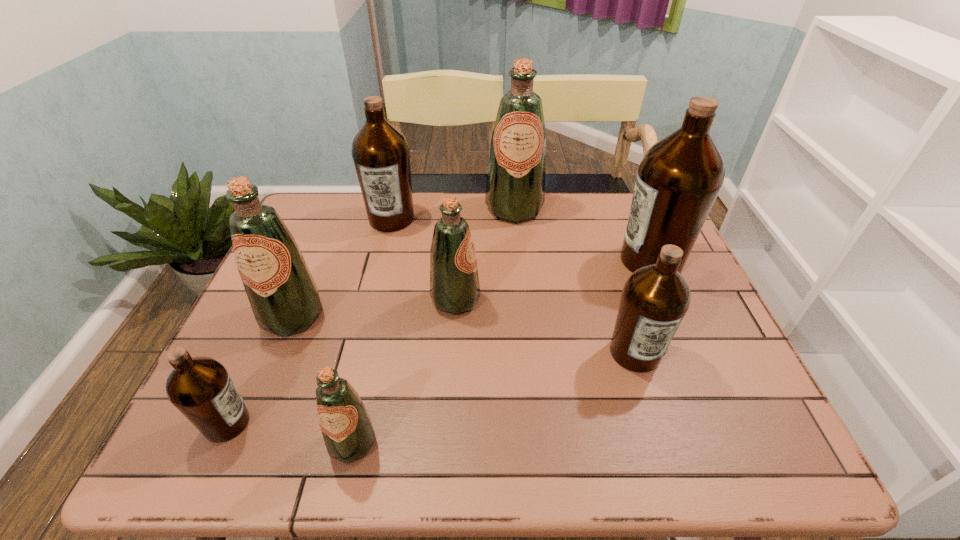
Select which olive oil appears as the seventh closest to the second nearest brown olive oil. Please provide its 2D coordinates. Your answer should be formatted as a tuple, i.e. [(x, y)], where the tuple contains the x and y coordinates of a point satisfying the conditions above.

[(200, 388)]

Choose which olive oil is the nearest neighbor to the leftmost green olive oil. Please provide its 2D coordinates. Your answer should be formatted as a tuple, i.e. [(x, y)], where the tuple contains the x and y coordinates of a point satisfying the conditions above.

[(200, 388)]

Identify which green olive oil is located as the second nearest to the third object from right to left. Please provide its 2D coordinates. Your answer should be formatted as a tuple, i.e. [(x, y)], where the tuple contains the x and y coordinates of a point satisfying the conditions above.

[(284, 298)]

The width and height of the screenshot is (960, 540). Find the location of `green olive oil object that ranks as the second closest to the third nearest brown olive oil`. green olive oil object that ranks as the second closest to the third nearest brown olive oil is located at coordinates (454, 282).

Choose which brown olive oil is the nearest neighbor to the third biggest brown olive oil. Please provide its 2D coordinates. Your answer should be formatted as a tuple, i.e. [(x, y)], where the tuple contains the x and y coordinates of a point satisfying the conditions above.

[(679, 178)]

Identify which brown olive oil is the second closest to the smallest brown olive oil. Please provide its 2D coordinates. Your answer should be formatted as a tuple, i.e. [(x, y)], where the tuple contains the x and y coordinates of a point satisfying the conditions above.

[(655, 298)]

The image size is (960, 540). I want to click on free space in the image that satisfies the following two spatial constraints: 1. on the front-facing side of the fifth object from left to right; 2. on the front-facing side of the smallest green olive oil, so click(x=447, y=442).

The height and width of the screenshot is (540, 960). Find the location of `vacant space that satisfies the following two spatial constraints: 1. on the label of the third nearest brown olive oil; 2. on the label of the third biggest brown olive oil`. vacant space that satisfies the following two spatial constraints: 1. on the label of the third nearest brown olive oil; 2. on the label of the third biggest brown olive oil is located at coordinates (690, 353).

Where is `free spot that satisfies the following two spatial constraints: 1. on the label of the second farthest brown olive oil; 2. on the front-facing side of the nearest green olive oil`? free spot that satisfies the following two spatial constraints: 1. on the label of the second farthest brown olive oil; 2. on the front-facing side of the nearest green olive oil is located at coordinates (729, 442).